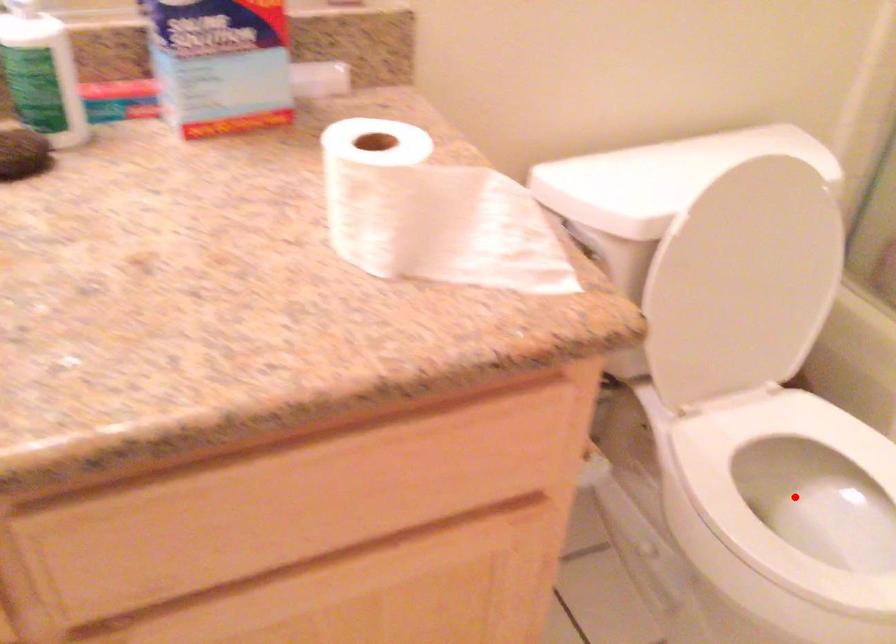
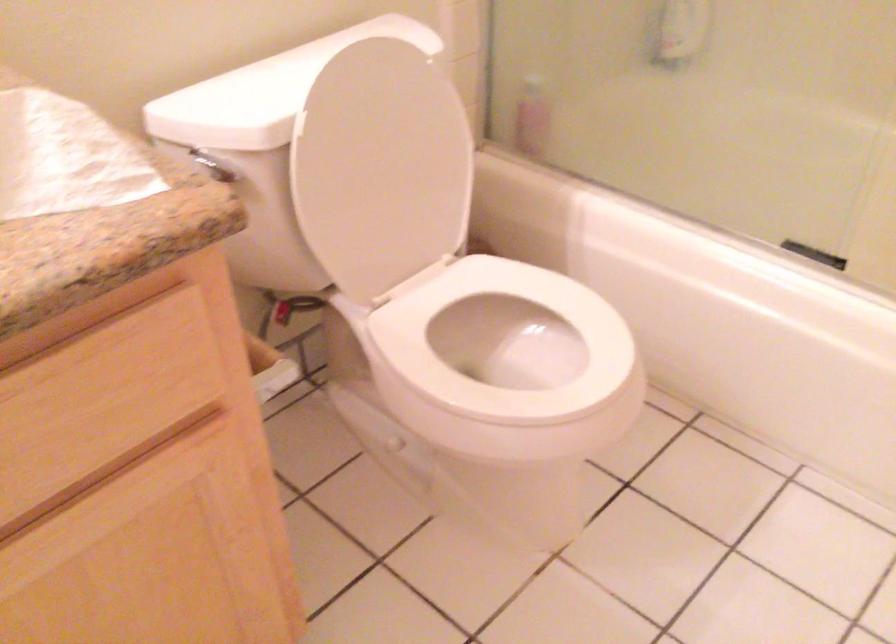
Locate, in the second image, the point that corresponds to the highlighted location in the first image.

(504, 348)